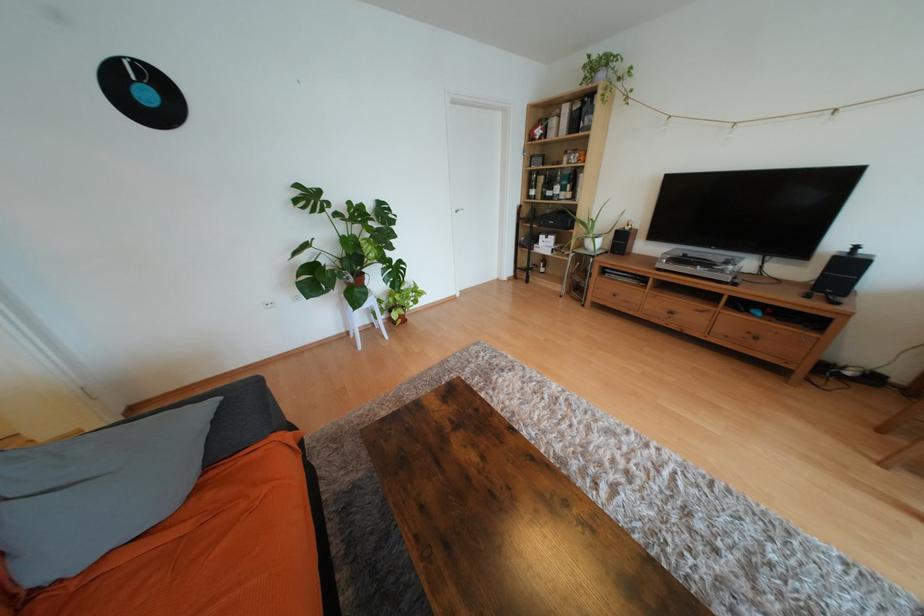
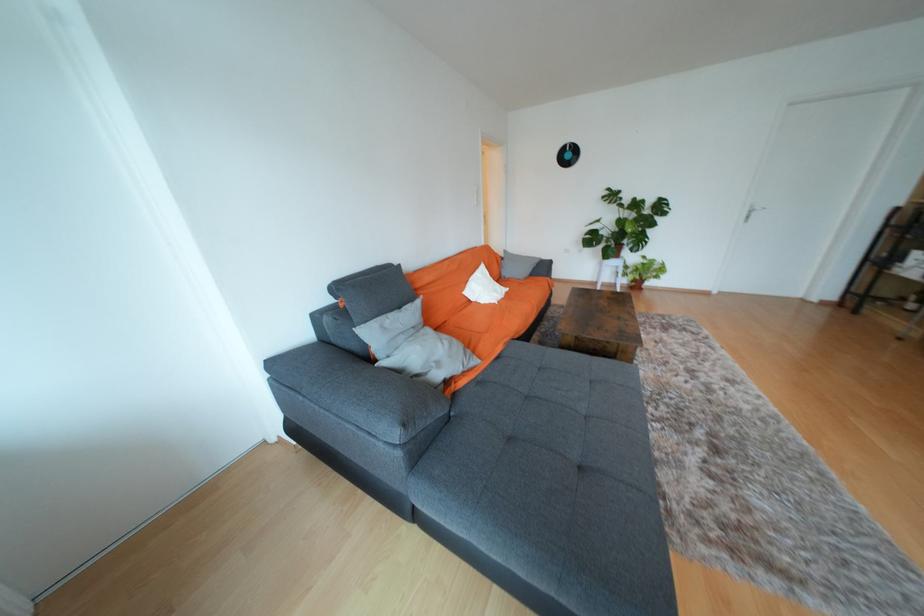
Where in the second image is the point corresponding to (x=348, y=331) from the first image?

(601, 282)